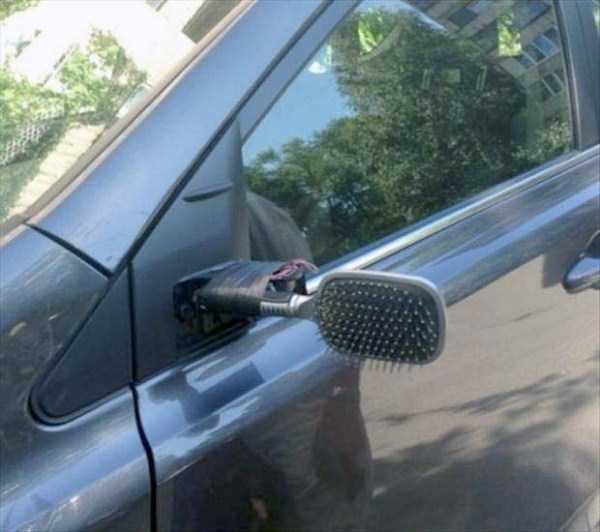
Where is `door handle`? This screenshot has height=532, width=600. door handle is located at coordinates (x=588, y=273).